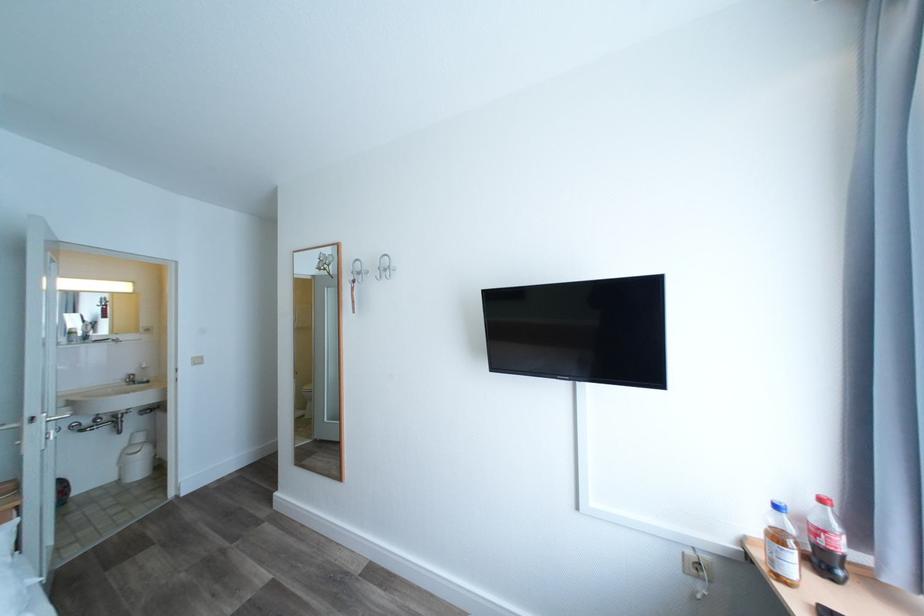
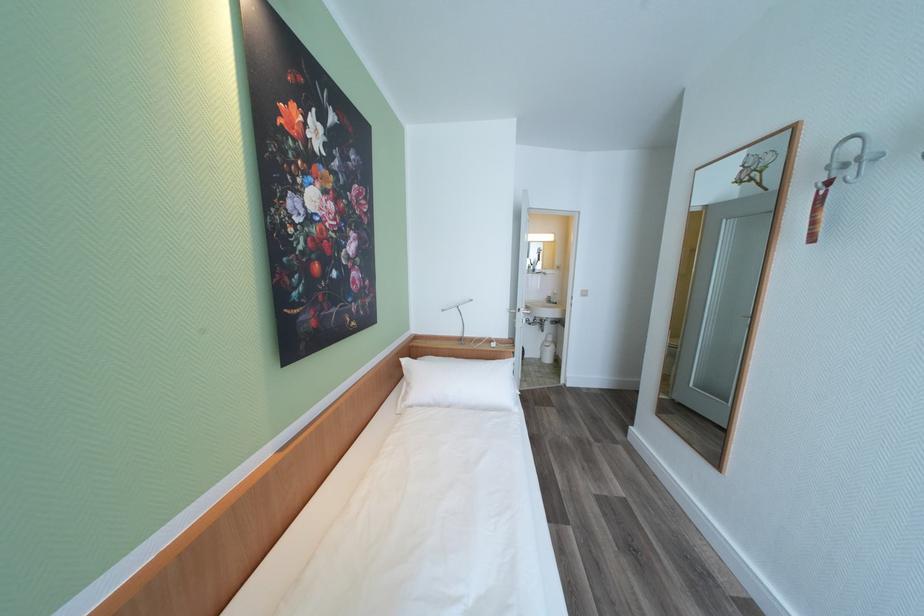
Where in the second image is the point corresponding to (130,378) from the first image?

(553, 299)